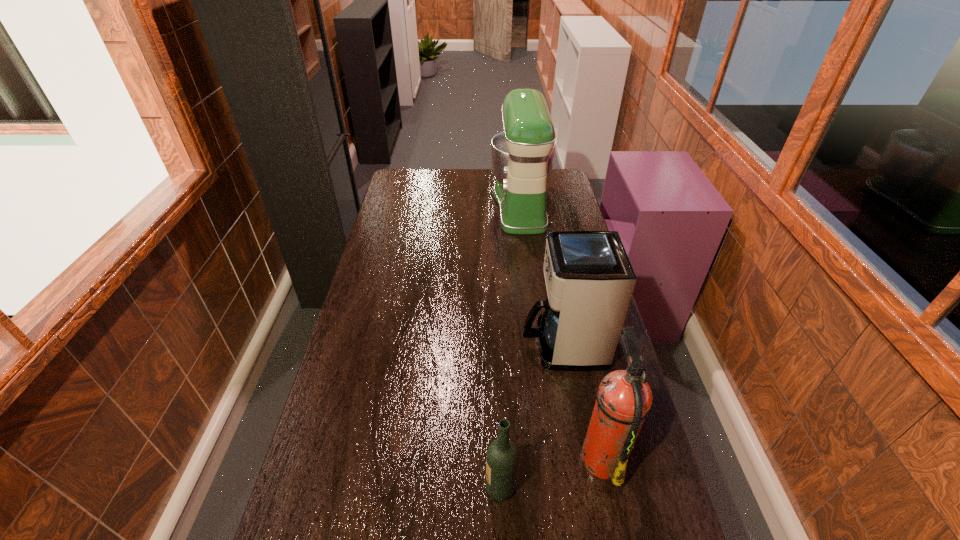
Locate an element on the screen. Image resolution: width=960 pixels, height=540 pixels. object situated at the far right corner is located at coordinates (522, 156).

This screenshot has height=540, width=960. I want to click on vacant region at the far edge of the desktop, so click(x=427, y=173).

Find the location of `vacant position at the left edge of the desktop`. vacant position at the left edge of the desktop is located at coordinates (387, 248).

What are the coordinates of `vacant area at the right edge` in the screenshot? It's located at (547, 230).

Locate an element on the screen. The image size is (960, 540). vacant space in between the third nearest object and the wine bottle is located at coordinates (531, 416).

The image size is (960, 540). I want to click on free space between the shortest object and the second farthest object, so click(x=531, y=416).

You are a GUI agent. You are given a task and a screenshot of the screen. Output one action in this format:
    pyautogui.click(x=<x>, y=<y>)
    Task: Click on the free space between the wine bottle and the third nearest object
    The height and width of the screenshot is (540, 960).
    Given the screenshot: What is the action you would take?
    pyautogui.click(x=531, y=416)

The image size is (960, 540). Identify the location of vacant area that lies between the shortest object and the fire extinguisher. (551, 472).

Locate an element on the screen. This screenshot has width=960, height=540. vacant area that lies between the wine bottle and the farthest object is located at coordinates (511, 346).

I want to click on free space between the coffee maker and the fire extinguisher, so pos(582,400).